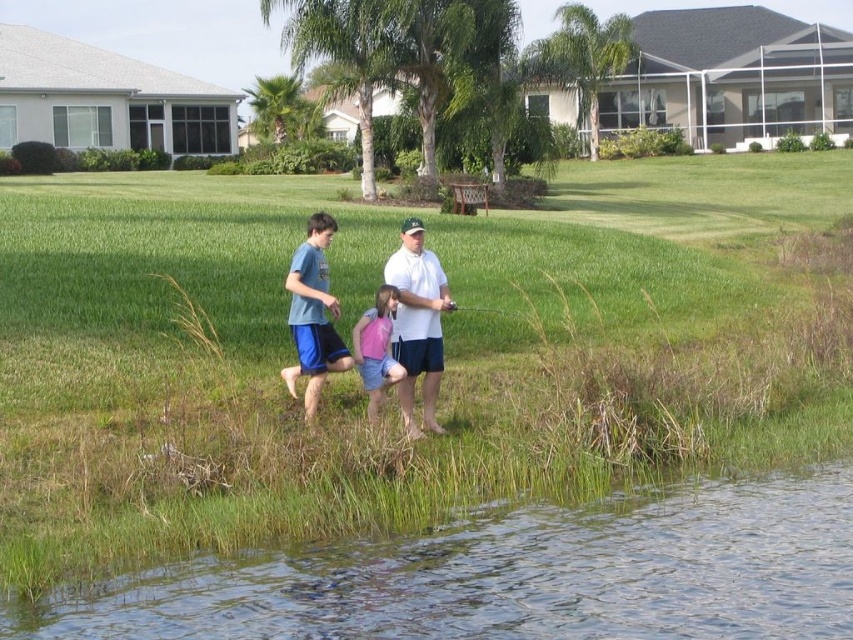
Who is shorter, green grass at center or blue cotton shorts at center?

blue cotton shorts at center

Which is in front, point (569, 221) or point (328, 336)?

Point (328, 336) is in front.

The image size is (853, 640). I want to click on green grass at center, so click(x=393, y=394).

Can you confirm if clear water at lower left is shorter than pink fabric dress at center?

Yes.

Is point (479, 612) behind point (352, 355)?

No, it is not.

Describe the element at coordinates (515, 576) in the screenshot. I see `clear water at lower left` at that location.

In order to click on clear water at lower left in this screenshot , I will do `click(515, 576)`.

Does point (222, 257) lie behind point (761, 579)?

Yes, it is behind point (761, 579).

Is green grass at center positioned behind clear water at lower left?

Yes, green grass at center is further from the viewer.

Locate an element on the screen. green grass at center is located at coordinates (393, 394).